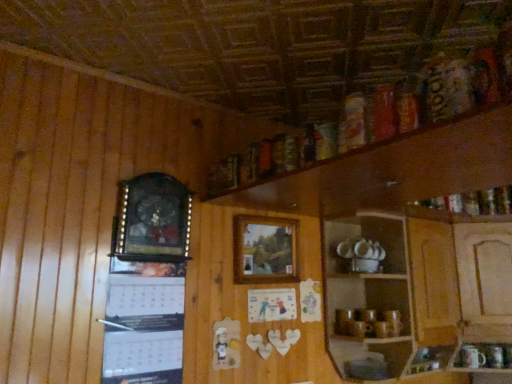
Question: From the image's perspective, is wooden picture frame at left, the 1th picture frame in the front-to-back sequence, over white paper calendar at upper left?

Choices:
 (A) yes
 (B) no

Answer: (A)

Question: Is white paper calendar at upper left at the back of wooden picture frame at left, which appears as the second picture frame when viewed from the right?

Choices:
 (A) no
 (B) yes

Answer: (A)

Question: Is wooden picture frame at left, which ranks as the 1th picture frame in left-to-right order, surrounding white paper calendar at upper left?

Choices:
 (A) yes
 (B) no

Answer: (B)

Question: Considering the relative sizes of wooden picture frame at left, which ranks as the 1th picture frame in left-to-right order, and white paper calendar at upper left in the image provided, is wooden picture frame at left, which ranks as the 1th picture frame in left-to-right order, bigger than white paper calendar at upper left?

Choices:
 (A) yes
 (B) no

Answer: (A)

Question: Is wooden picture frame at left, the 2th picture frame viewed from the back, at the right side of white paper calendar at upper left?

Choices:
 (A) no
 (B) yes

Answer: (B)

Question: In terms of size, does white paper calendar at upper left appear bigger or smaller than wooden picture frame at center, the 2th picture frame in the left-to-right sequence?

Choices:
 (A) big
 (B) small

Answer: (A)

Question: From a real-world perspective, is white paper calendar at upper left positioned above or below wooden picture frame at center, marked as the 1th picture frame in a right-to-left arrangement?

Choices:
 (A) above
 (B) below

Answer: (B)

Question: Is white paper calendar at upper left situated inside wooden picture frame at center, the 2th picture frame in the left-to-right sequence, or outside?

Choices:
 (A) inside
 (B) outside

Answer: (B)

Question: From the image's perspective, is white paper calendar at upper left located above or below wooden picture frame at center, which is counted as the second picture frame, starting from the front?

Choices:
 (A) below
 (B) above

Answer: (A)

Question: In terms of width, does wooden picture frame at center, the 1th picture frame when ordered from back to front, look wider or thinner when compared to wooden picture frame at left, which ranks as the 1th picture frame in left-to-right order?

Choices:
 (A) thin
 (B) wide

Answer: (A)

Question: Choose the correct answer: Is wooden picture frame at center, which is counted as the second picture frame, starting from the front, inside wooden picture frame at left, which appears as the second picture frame when viewed from the right, or outside it?

Choices:
 (A) outside
 (B) inside

Answer: (A)

Question: From the image's perspective, is wooden picture frame at center, which is counted as the second picture frame, starting from the front, located above or below wooden picture frame at left, the 1th picture frame in the front-to-back sequence?

Choices:
 (A) above
 (B) below

Answer: (B)

Question: From a real-world perspective, is wooden picture frame at center, the 1th picture frame when ordered from back to front, physically located above or below wooden picture frame at left, the 2th picture frame viewed from the back?

Choices:
 (A) below
 (B) above

Answer: (A)

Question: Considering the positions of wooden picture frame at center, marked as the 1th picture frame in a right-to-left arrangement, and wooden cabinet at lower right in the image, is wooden picture frame at center, marked as the 1th picture frame in a right-to-left arrangement, wider or thinner than wooden cabinet at lower right?

Choices:
 (A) thin
 (B) wide

Answer: (A)

Question: From a real-world perspective, relative to wooden cabinet at lower right, is wooden picture frame at center, which is counted as the second picture frame, starting from the front, vertically above or below?

Choices:
 (A) below
 (B) above

Answer: (B)